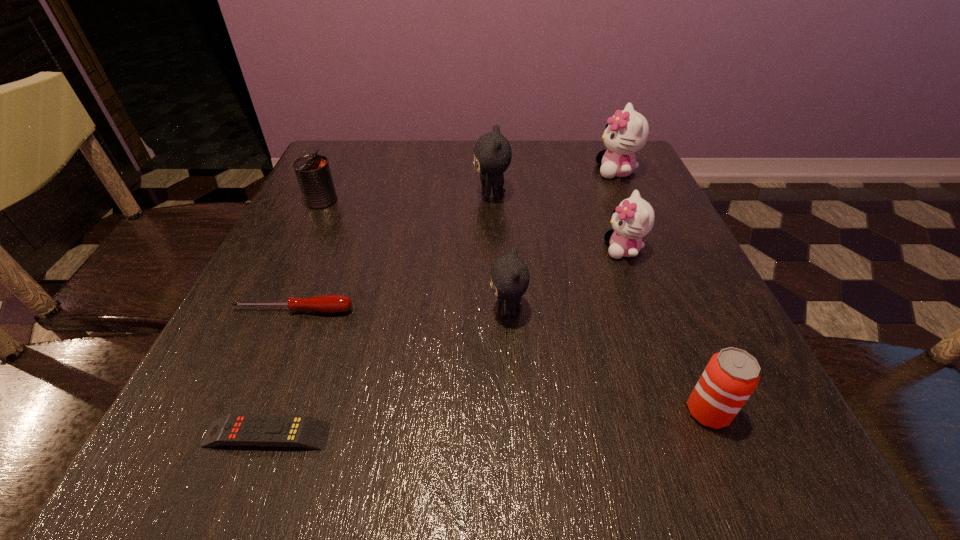
You are a GUI agent. You are given a task and a screenshot of the screen. Output one action in this format:
    pyautogui.click(x=<x>, y=<y>)
    Task: Click on the remote control
    Image resolution: width=960 pixels, height=540 pixels.
    Given the screenshot: What is the action you would take?
    pyautogui.click(x=302, y=431)

In order to click on the shortest object in this screenshot , I will do `click(302, 431)`.

Find the location of `blank area located on the front-facing side of the farther white kitten`. blank area located on the front-facing side of the farther white kitten is located at coordinates (431, 171).

Identify the location of free location located on the front-facing side of the farther white kitten. Image resolution: width=960 pixels, height=540 pixels. (559, 171).

Identify the location of free space located 0.390m on the front-facing side of the farther white kitten. The height and width of the screenshot is (540, 960). (435, 171).

Find the location of a particular element. free space located 0.060m on the front-facing side of the bigger gray kitten is located at coordinates (446, 194).

Locate an element on the screen. Image resolution: width=960 pixels, height=540 pixels. free point located 0.050m on the front-facing side of the bigger gray kitten is located at coordinates (451, 194).

The height and width of the screenshot is (540, 960). Identify the location of vacant region located on the front-facing side of the bigger gray kitten. (358, 194).

Find the location of a particular element. The width and height of the screenshot is (960, 540). vacant space positioned 0.150m on the back of the can is located at coordinates (341, 160).

Locate an element on the screen. vacant space situated 0.270m on the front-facing side of the third farthest kitten is located at coordinates (465, 249).